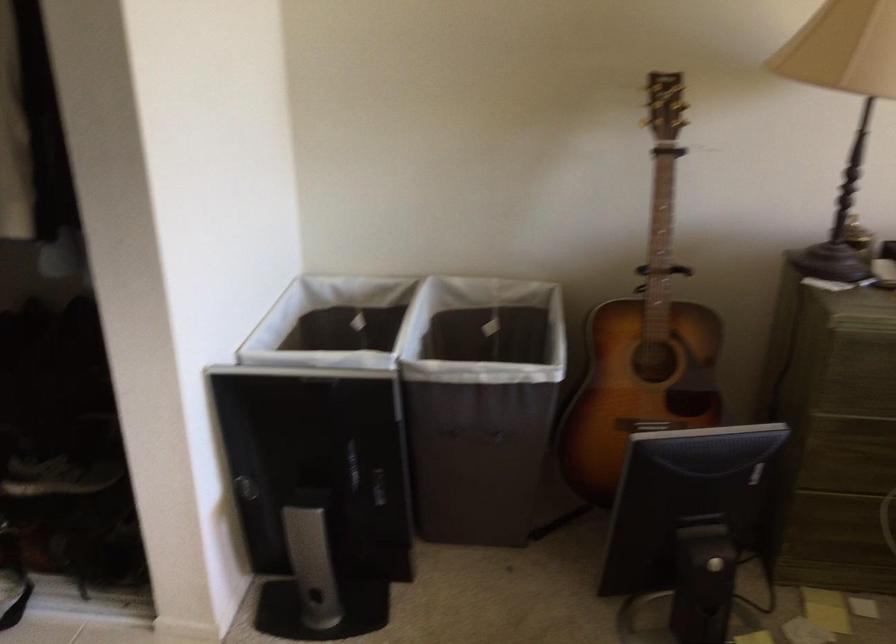
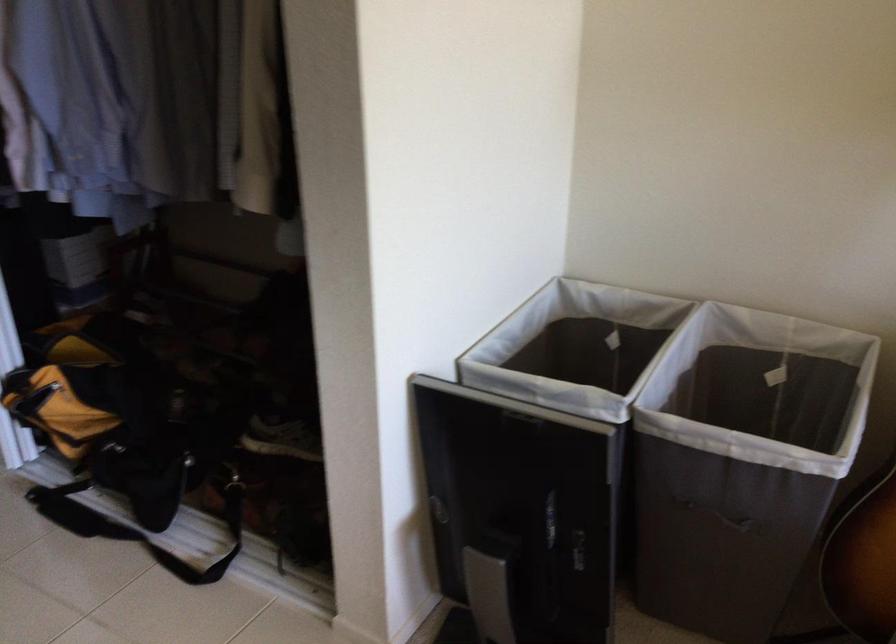
The point at (x=323, y=339) is marked in the first image. Where is the corresponding point in the second image?

(574, 346)